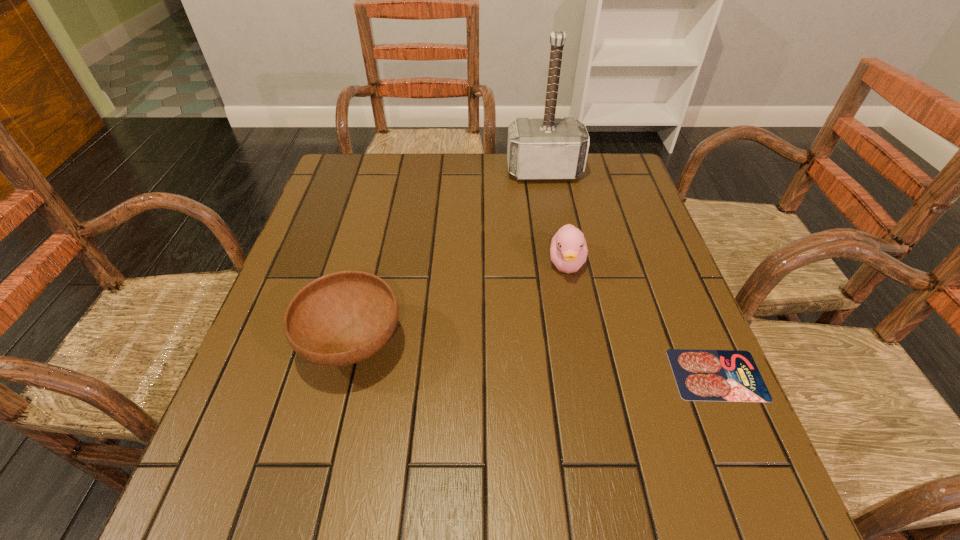
You are a GUI agent. You are given a task and a screenshot of the screen. Output one action in this format:
    pyautogui.click(x=<x>, y=<y>)
    Task: Click on the vacant area in the image that satisfies the following two spatial constraints: 1. on the front side of the salami; 2. on the left side of the tallest object
    This screenshot has height=540, width=960.
    Given the screenshot: What is the action you would take?
    pyautogui.click(x=581, y=374)